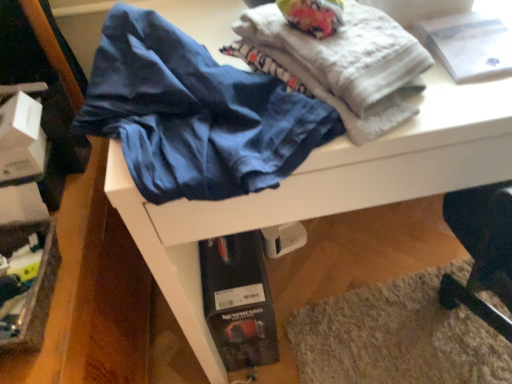
Question: In the image, is matte blue underwear at center positioned in front of or behind white textured towel at upper center?

Choices:
 (A) front
 (B) behind

Answer: (A)

Question: From the image's perspective, is matte blue underwear at center positioned above or below white textured towel at upper center?

Choices:
 (A) above
 (B) below

Answer: (B)

Question: Estimate the real-world distances between objects in this image. Which object is closer to the white textured towel at upper center?

Choices:
 (A) white paper at upper right
 (B) matte blue underwear at center

Answer: (B)

Question: Which object is positioned farthest from the matte blue underwear at center?

Choices:
 (A) white paper at upper right
 (B) white textured towel at upper center

Answer: (A)